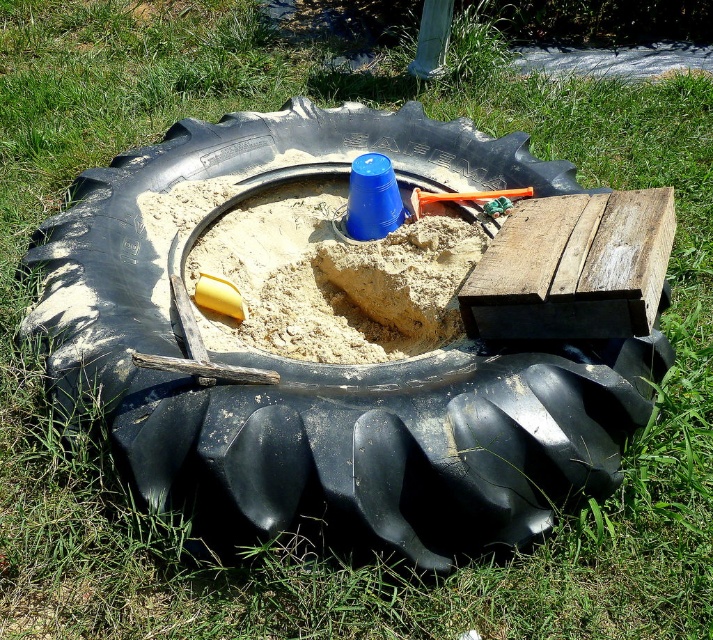
You are standing at the edge of the sandbox and want to place a new toy exactly where the black rubber tire at center is located. According to the coordinates provided, where should you place the toy?

The black rubber tire at center is located at point (334, 365), so you should place the new toy at those coordinates.